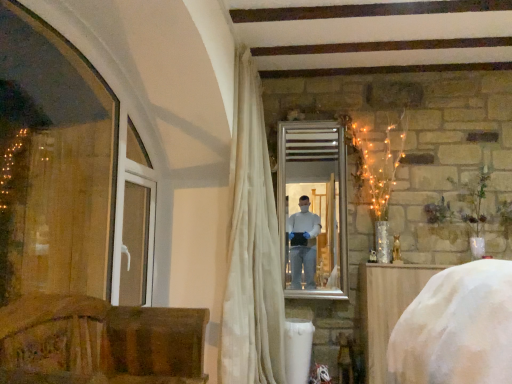
Question: Is silver/metallic mirror at center not near wooden chair at lower left, the second furniture viewed from the back?

Choices:
 (A) yes
 (B) no

Answer: (A)

Question: Does silver/metallic mirror at center turn towards wooden chair at lower left, placed as the first furniture when sorted from left to right?

Choices:
 (A) yes
 (B) no

Answer: (B)

Question: Is silver/metallic mirror at center facing away from wooden chair at lower left, positioned as the second furniture in right-to-left order?

Choices:
 (A) yes
 (B) no

Answer: (B)

Question: Does silver/metallic mirror at center appear on the right side of wooden chair at lower left, the second furniture viewed from the back?

Choices:
 (A) yes
 (B) no

Answer: (A)

Question: Is silver/metallic mirror at center positioned behind wooden chair at lower left, positioned as the second furniture in right-to-left order?

Choices:
 (A) yes
 (B) no

Answer: (A)

Question: From a real-world perspective, does silver/metallic mirror at center stand above wooden chair at lower left, which is the 1th furniture in front-to-back order?

Choices:
 (A) yes
 (B) no

Answer: (A)

Question: Does white plastic window frame at left have a greater width compared to white fabric-covered object at lower right, the first furniture from the back?

Choices:
 (A) yes
 (B) no

Answer: (B)

Question: Is white plastic window frame at left directly adjacent to white fabric-covered object at lower right, which is the second furniture in front-to-back order?

Choices:
 (A) yes
 (B) no

Answer: (B)

Question: Does white plastic window frame at left have a greater height compared to white fabric-covered object at lower right, positioned as the second furniture in left-to-right order?

Choices:
 (A) no
 (B) yes

Answer: (A)

Question: From the image's perspective, does white plastic window frame at left appear lower than white fabric-covered object at lower right, which is counted as the 1th furniture, starting from the right?

Choices:
 (A) yes
 (B) no

Answer: (B)

Question: Does white plastic window frame at left lie behind white fabric-covered object at lower right, which is the second furniture in front-to-back order?

Choices:
 (A) yes
 (B) no

Answer: (B)

Question: Can you confirm if white plastic window frame at left is bigger than white fabric-covered object at lower right, positioned as the second furniture in left-to-right order?

Choices:
 (A) no
 (B) yes

Answer: (A)

Question: Is white plastic window frame at left in contact with silver/metallic mirror at center?

Choices:
 (A) no
 (B) yes

Answer: (A)